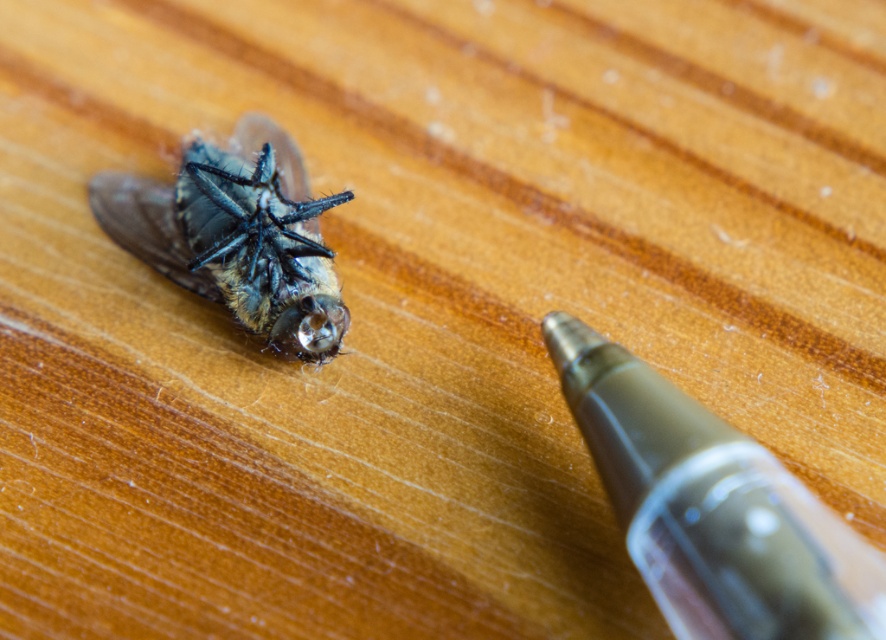
Who is positioned more to the left, transparent plastic pen at lower right or shiny black insect at upper left?

shiny black insect at upper left is more to the left.

Who is higher up, transparent plastic pen at lower right or shiny black insect at upper left?

Positioned higher is shiny black insect at upper left.

Locate an element on the screen. transparent plastic pen at lower right is located at coordinates (711, 508).